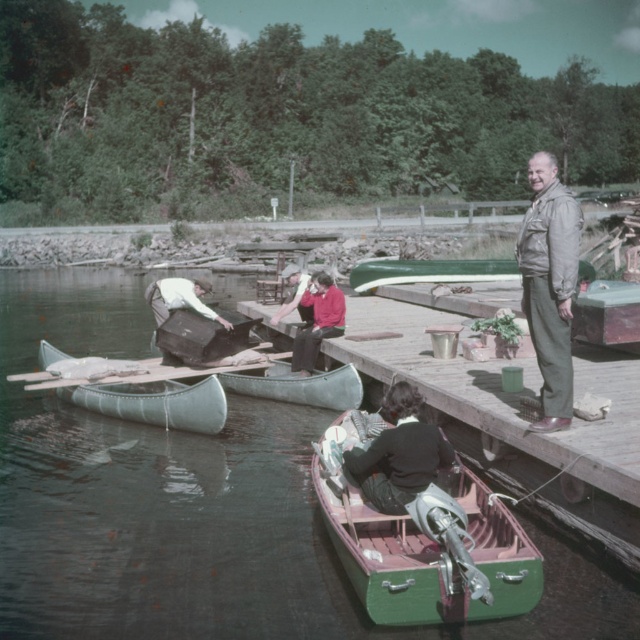
This screenshot has width=640, height=640. Describe the element at coordinates (426, 545) in the screenshot. I see `green polished wood boat at lower center` at that location.

Is green polished wood boat at lower center to the left of light brown leather jacket at center from the viewer's perspective?

Incorrect, green polished wood boat at lower center is not on the left side of light brown leather jacket at center.

Does point (360, 595) come behind point (193, 292)?

No, it is in front of (193, 292).

The height and width of the screenshot is (640, 640). Find the location of `green polished wood boat at lower center`. green polished wood boat at lower center is located at coordinates (426, 545).

Is green rubber boat at lower left to the right of dark green fabric jacket at lower center from the viewer's perspective?

In fact, green rubber boat at lower left is to the left of dark green fabric jacket at lower center.

Which of these two, green rubber boat at lower left or dark green fabric jacket at lower center, stands shorter?

dark green fabric jacket at lower center is shorter.

Between point (291, 561) and point (346, 476), which one is positioned in front?

Point (346, 476) is more forward.

The width and height of the screenshot is (640, 640). What are the coordinates of `green rubber boat at lower left` in the screenshot? It's located at (193, 506).

Between green canvas canoe at center and light brown leather jacket at center, which one is positioned lower?

Positioned lower is green canvas canoe at center.

Can you confirm if green canvas canoe at center is smaller than light brown leather jacket at center?

Indeed, green canvas canoe at center has a smaller size compared to light brown leather jacket at center.

Is point (179, 428) positioned before point (216, 317)?

Yes.

Where is `green canvas canoe at center`? The width and height of the screenshot is (640, 640). green canvas canoe at center is located at coordinates (156, 403).